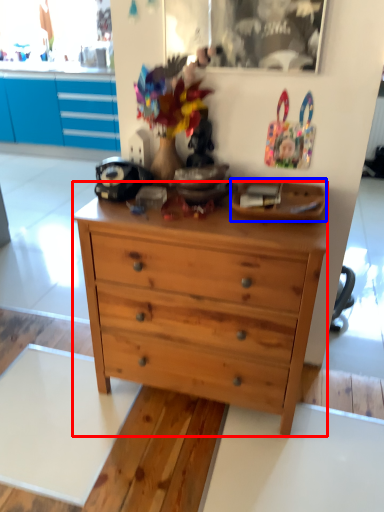
Question: Among these objects, which one is farthest to the camera, chest of drawers (highlighted by a red box) or plate (highlighted by a blue box)?

Choices:
 (A) chest of drawers
 (B) plate

Answer: (B)